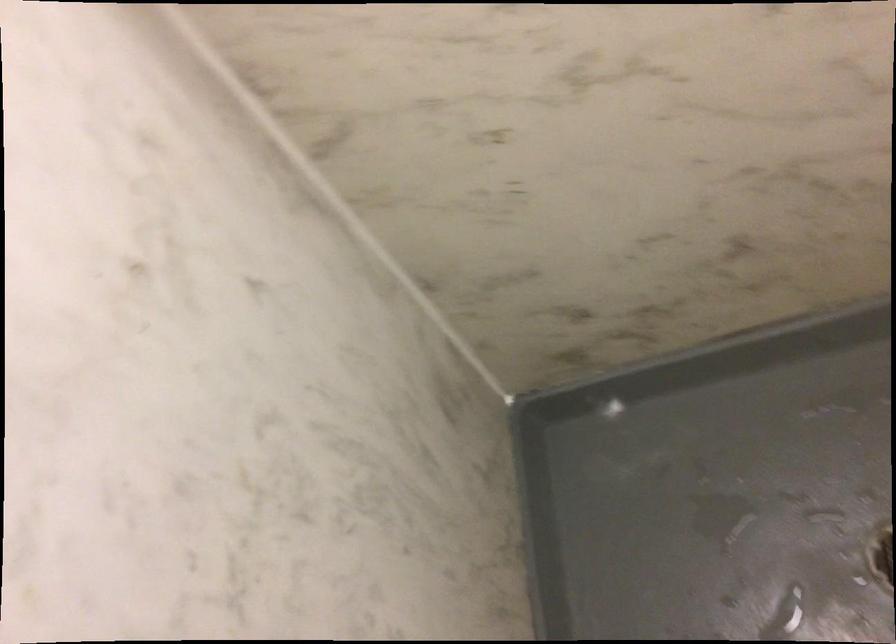
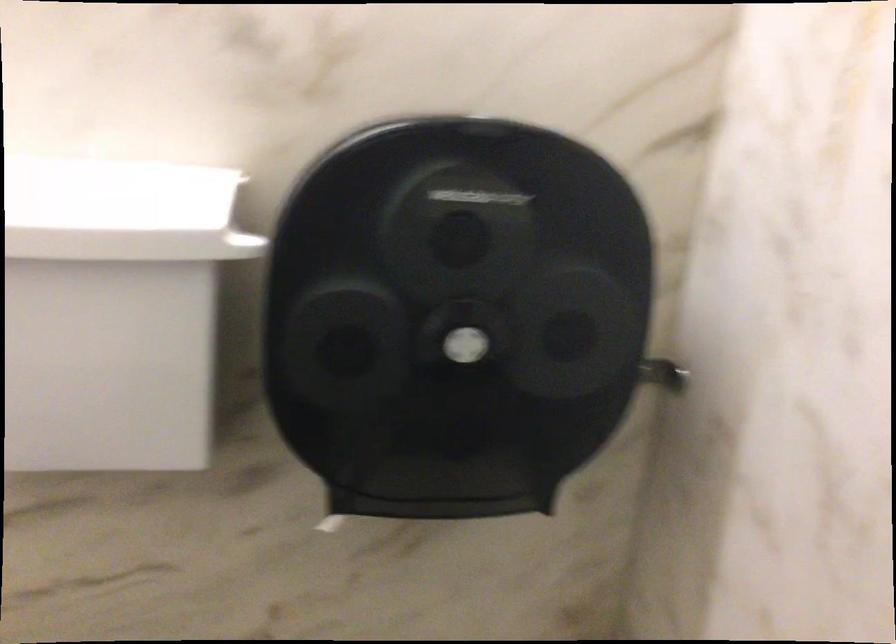
Question: Based on the continuous images, in which direction is the camera rotating? Reply with the corresponding letter.

Choices:
 (A) Left
 (B) Right
 (C) Up
 (D) Down

Answer: (B)